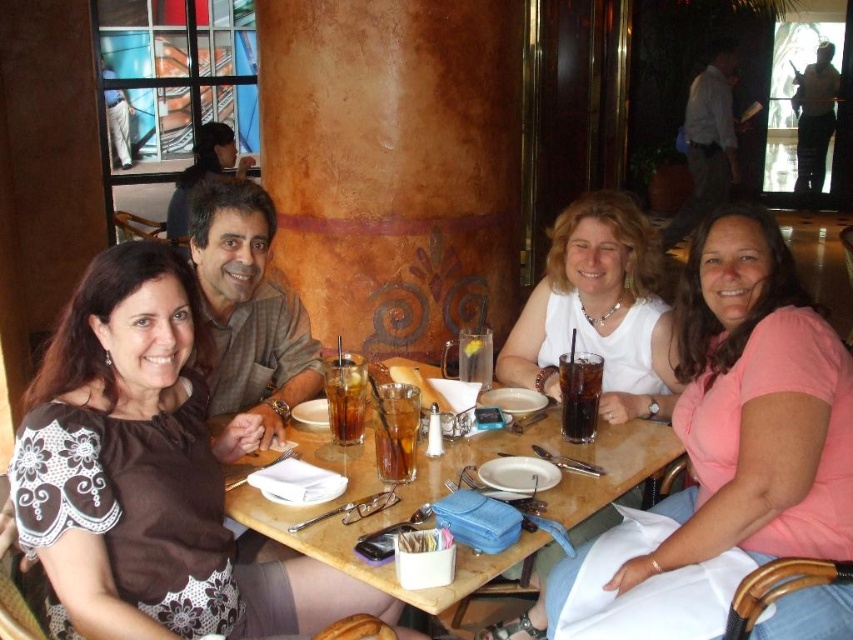
Does matte white blouse at center appear under dark glass cola at center?

Correct, matte white blouse at center is located below dark glass cola at center.

Measure the distance between matte white blouse at center and camera.

A distance of 1.49 meters exists between matte white blouse at center and camera.

Which is behind, point (775, 529) or point (602, 362)?

Positioned behind is point (602, 362).

Locate an element on the screen. matte white blouse at center is located at coordinates (753, 406).

Which of these two, wooden table at center or dark brown glass at table center, stands taller?

Standing taller between the two is wooden table at center.

Who is positioned more to the left, wooden table at center or dark brown glass at table center?

dark brown glass at table center is more to the left.

Locate an element on the screen. The image size is (853, 640). wooden table at center is located at coordinates (445, 492).

Can you confirm if white matte shirt at center is bigger than dark brown glass at table center?

Indeed, white matte shirt at center has a larger size compared to dark brown glass at table center.

Is white matte shirt at center smaller than dark brown glass at table center?

Incorrect, white matte shirt at center is not smaller in size than dark brown glass at table center.

The image size is (853, 640). I want to click on white matte shirt at center, so click(599, 310).